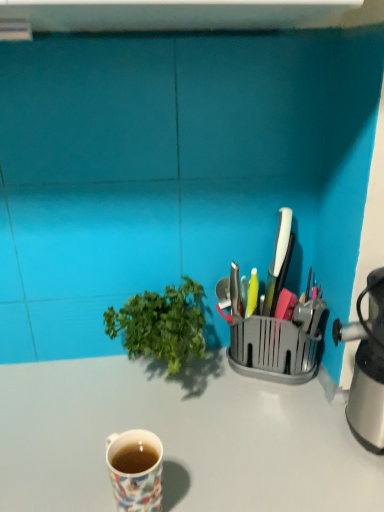
The height and width of the screenshot is (512, 384). Identify the location of vacant space in green leafy plant at center (from a real-world perspective). (155, 391).